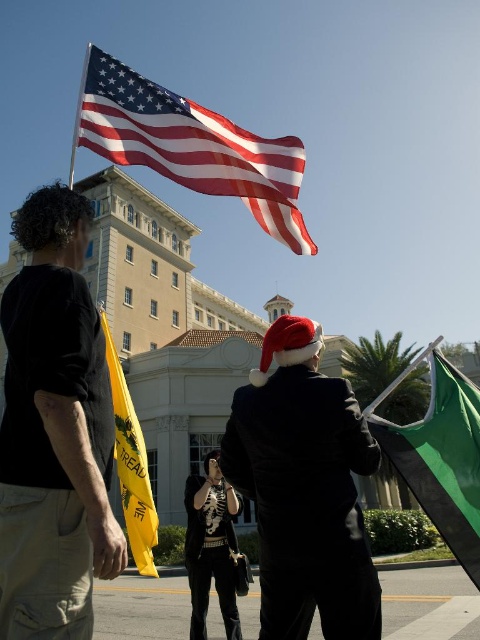
Based on the photo, you are standing at the origin point in this outdoor scene. There is a black cotton tshirt at left located at point (54,429). Can you tell me the direction of the black cotton tshirt at left relative to your position?

The black cotton tshirt at left is located at point (54,429), which is to the right and slightly above your current position at the origin.